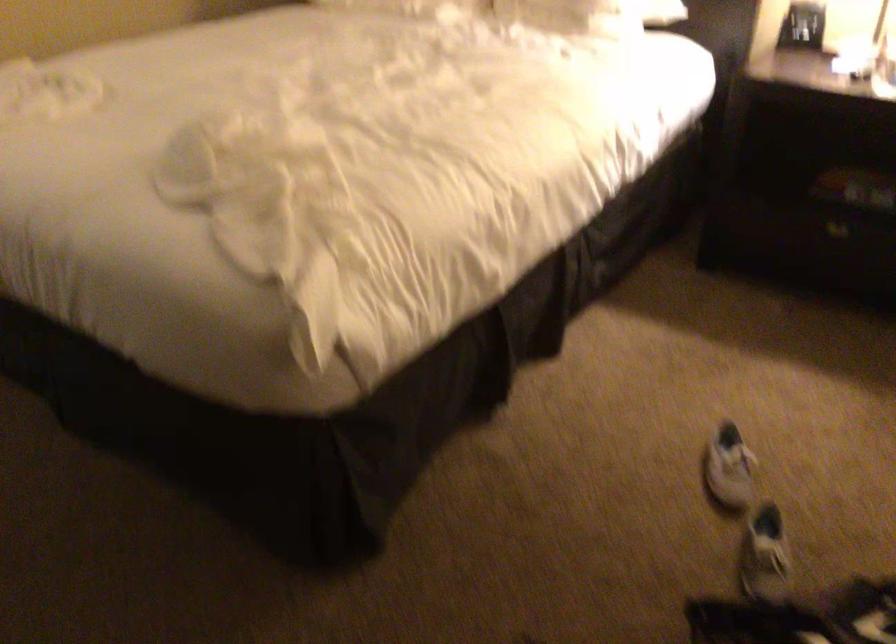
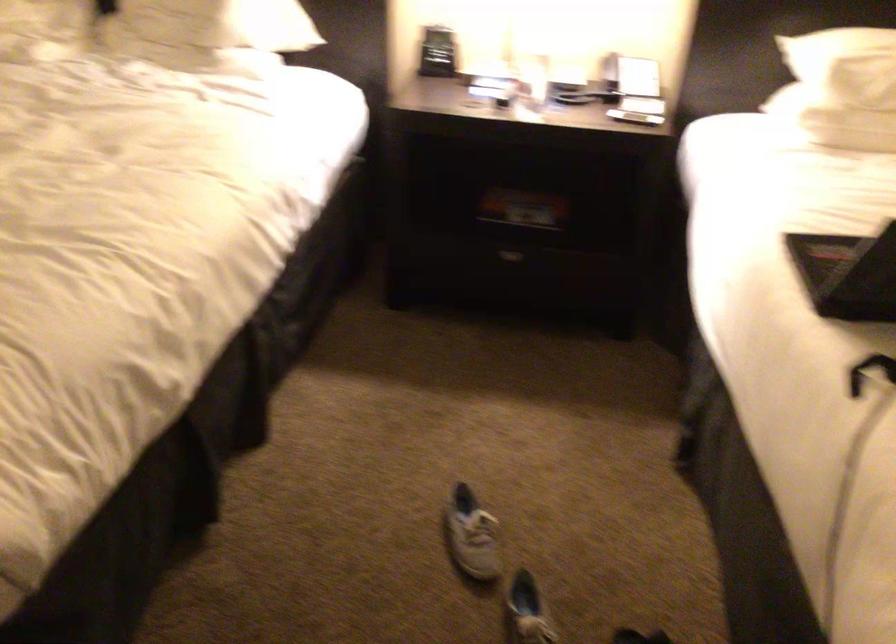
Question: The camera is either moving clockwise (left) or counter-clockwise (right) around the object. The first image is from the beginning of the video and the second image is from the end. Is the camera moving left or right when shooting the video?

Choices:
 (A) Left
 (B) Right

Answer: (A)